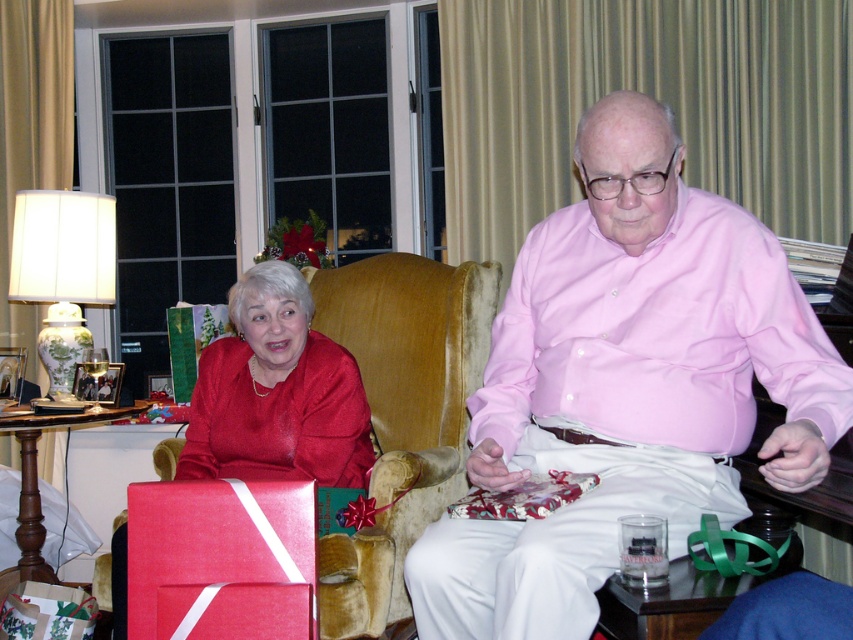
Does pink cotton shirt at center appear on the right side of satin red dress at lower left?

Correct, you'll find pink cotton shirt at center to the right of satin red dress at lower left.

Locate an element on the screen. Image resolution: width=853 pixels, height=640 pixels. pink cotton shirt at center is located at coordinates (625, 384).

Which is in front, point (804, 369) or point (316, 416)?

Point (804, 369) is in front.

Image resolution: width=853 pixels, height=640 pixels. In order to click on pink cotton shirt at center in this screenshot , I will do `click(625, 384)`.